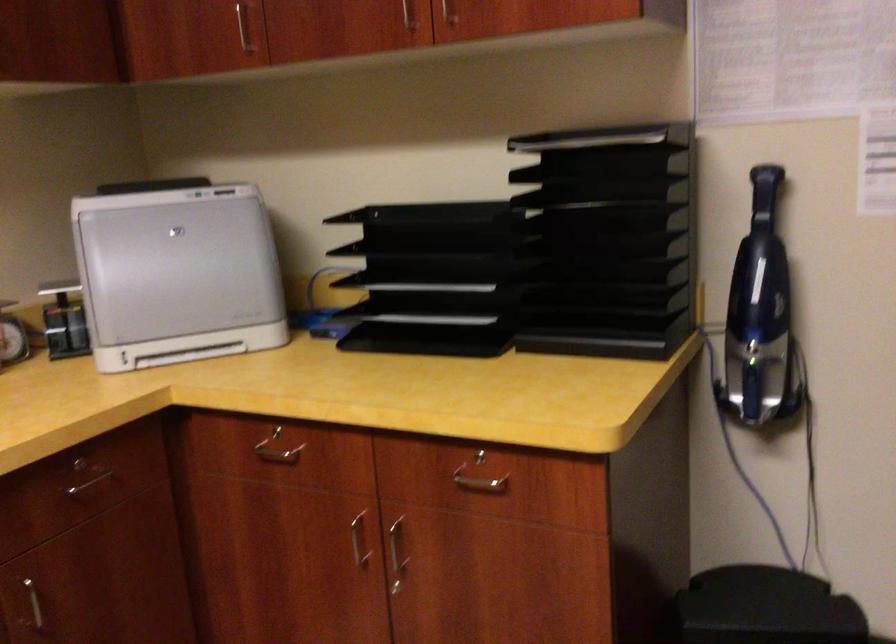
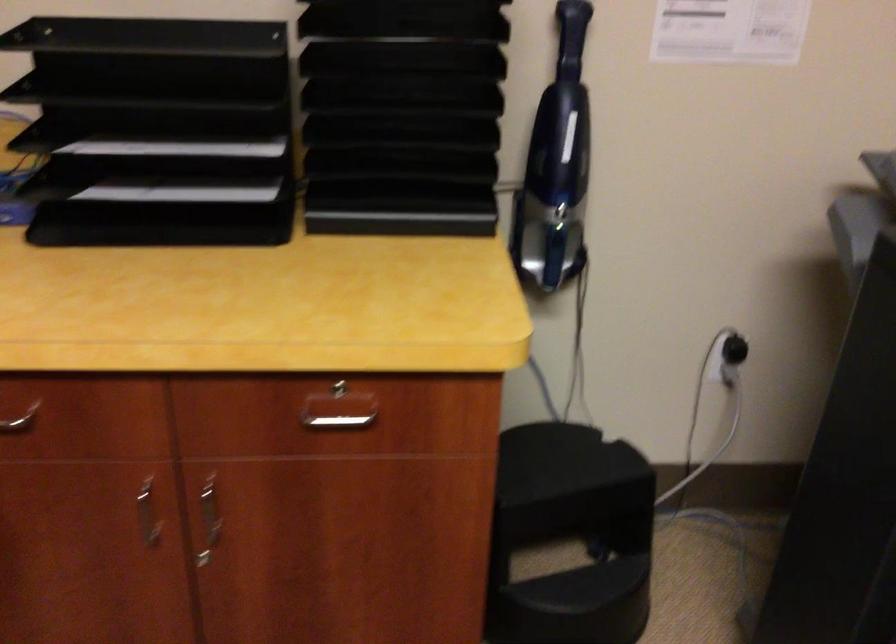
Find the pixel in the second image that matches [440,249] in the first image.

(156, 89)